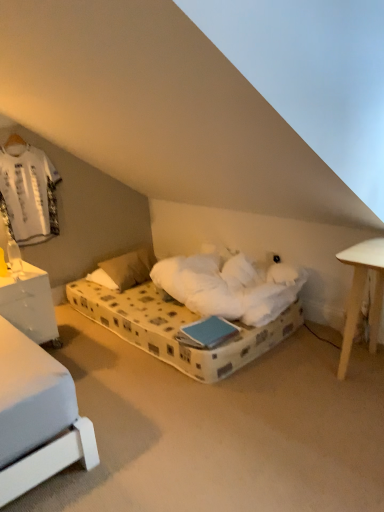
Question: From a real-world perspective, is white plastic table lamp at left above or below white glossy nightstand at left?

Choices:
 (A) below
 (B) above

Answer: (B)

Question: In terms of height, does white plastic table lamp at left look taller or shorter compared to white glossy nightstand at left?

Choices:
 (A) tall
 (B) short

Answer: (B)

Question: Estimate the real-world distances between objects in this image. Which object is closer to the white plastic table lamp at left?

Choices:
 (A) white glossy nightstand at left
 (B) white soft pillow at center

Answer: (A)

Question: Which object is positioned closest to the white glossy nightstand at left?

Choices:
 (A) white soft pillow at center
 (B) white plastic table lamp at left

Answer: (B)